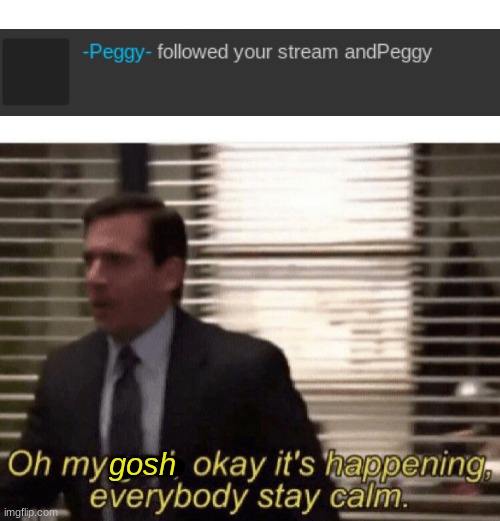
Locate an element on the screen. The width and height of the screenshot is (500, 521). coat is located at coordinates (225, 401).